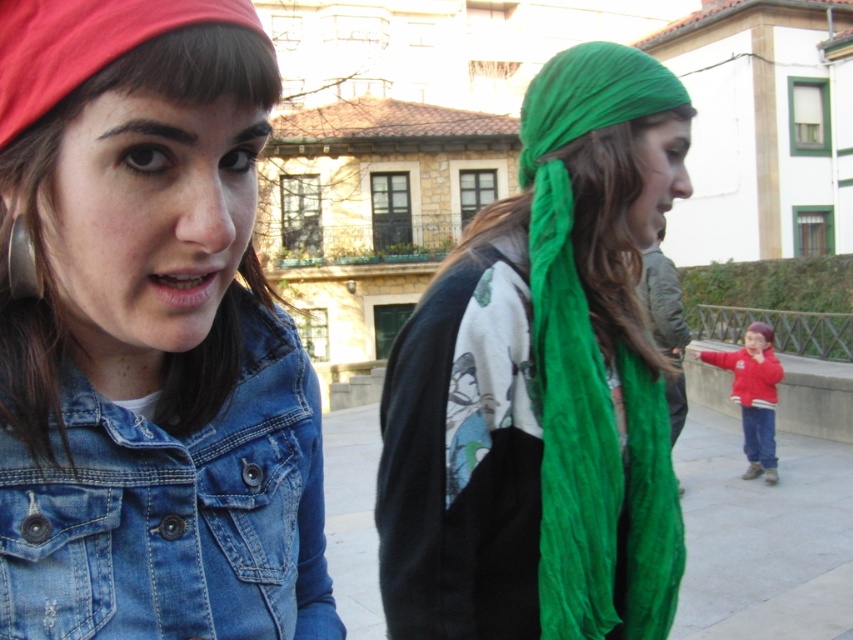
Based on the scene description, which object has a smaller width between the brownhair at left and the red fleece jacket at right?

The brownhair at left is thinner than the red fleece jacket at right, so the brownhair at left has a smaller width.